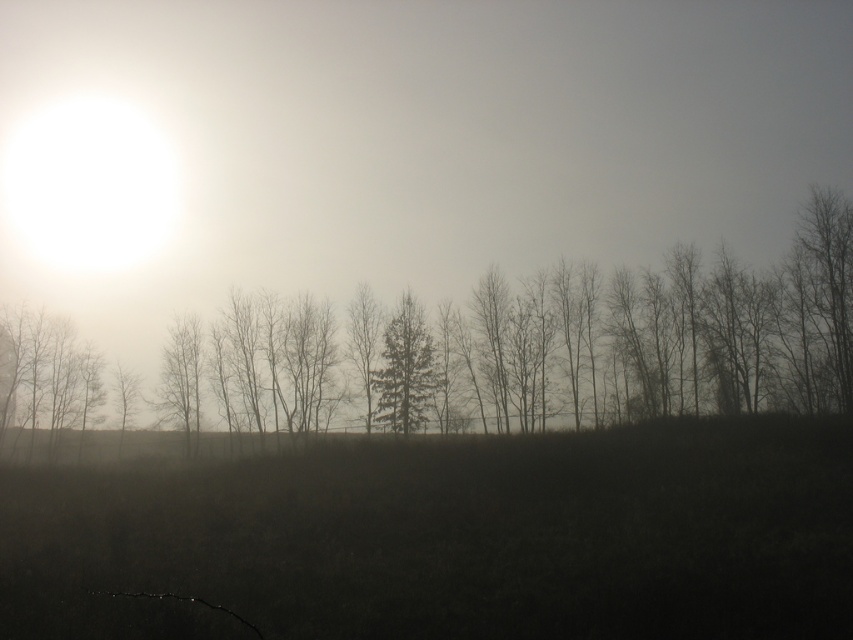
Question: Is dark grass at center behind green matte tree at center?

Choices:
 (A) yes
 (B) no

Answer: (B)

Question: Is dark grass at center below green matte tree at center?

Choices:
 (A) yes
 (B) no

Answer: (B)

Question: Estimate the real-world distances between objects in this image. Which object is closer to the silhouette bare tree at center?

Choices:
 (A) green matte tree at center
 (B) dark grass at center

Answer: (A)

Question: Can you confirm if silhouette bare tree at center is wider than green matte tree at center?

Choices:
 (A) yes
 (B) no

Answer: (A)

Question: Which object is closer to the camera taking this photo?

Choices:
 (A) green matte tree at center
 (B) silhouette bare tree at center
 (C) dark grass at center

Answer: (C)

Question: Which of these objects is positioned farthest from the dark grass at center?

Choices:
 (A) silhouette bare tree at center
 (B) green matte tree at center

Answer: (B)